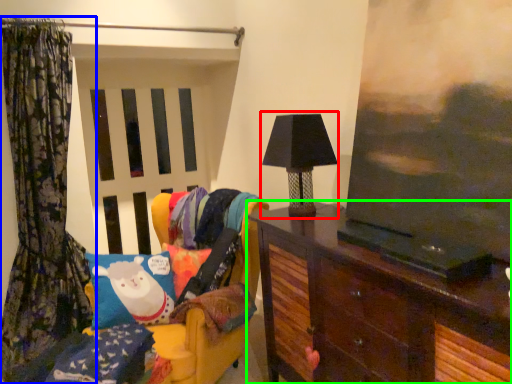
Question: Which object is the farthest from table lamp (highlighted by a red box)? Choose among these: curtain (highlighted by a blue box) or furniture (highlighted by a green box).

Choices:
 (A) curtain
 (B) furniture

Answer: (A)